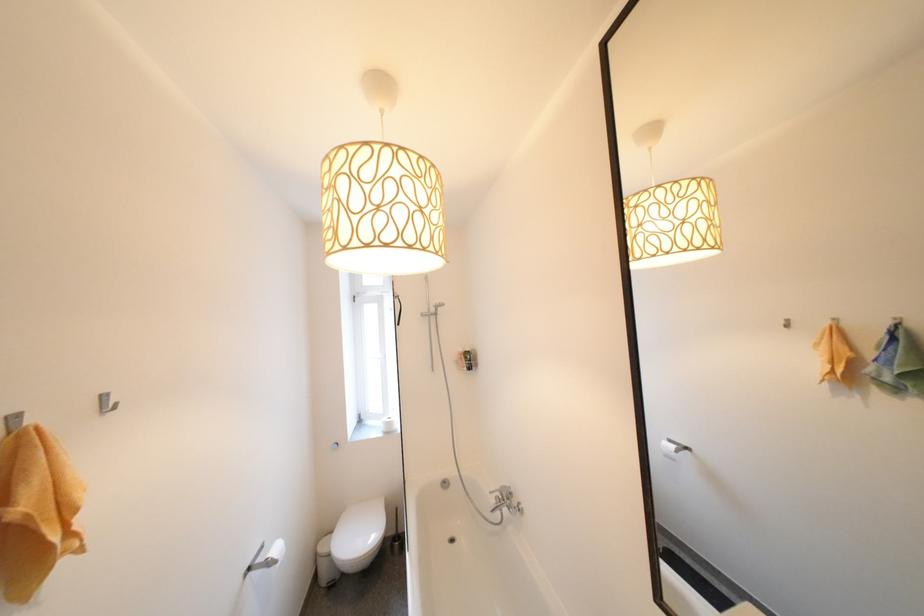
The height and width of the screenshot is (616, 924). What do you see at coordinates (504, 500) in the screenshot?
I see `the silver faucet handle` at bounding box center [504, 500].